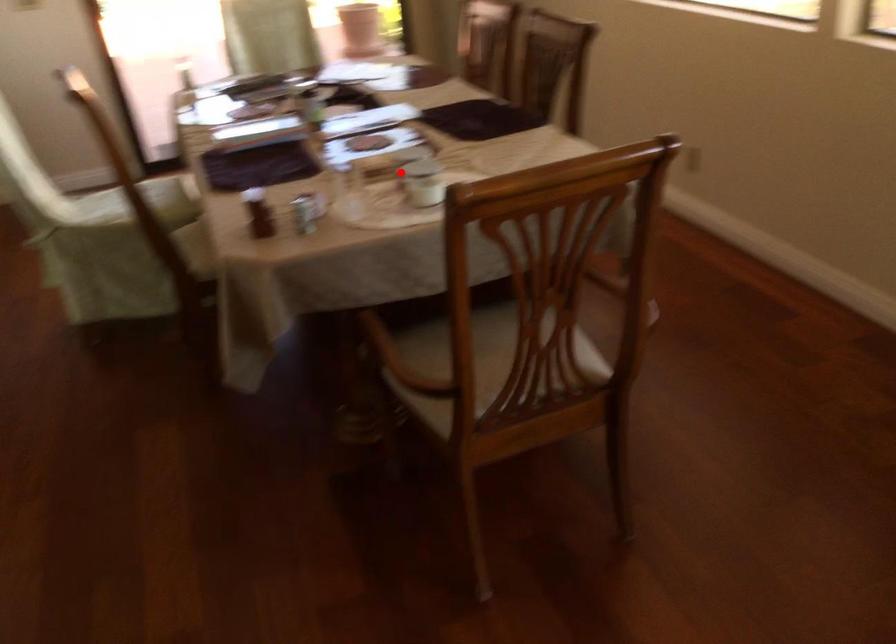
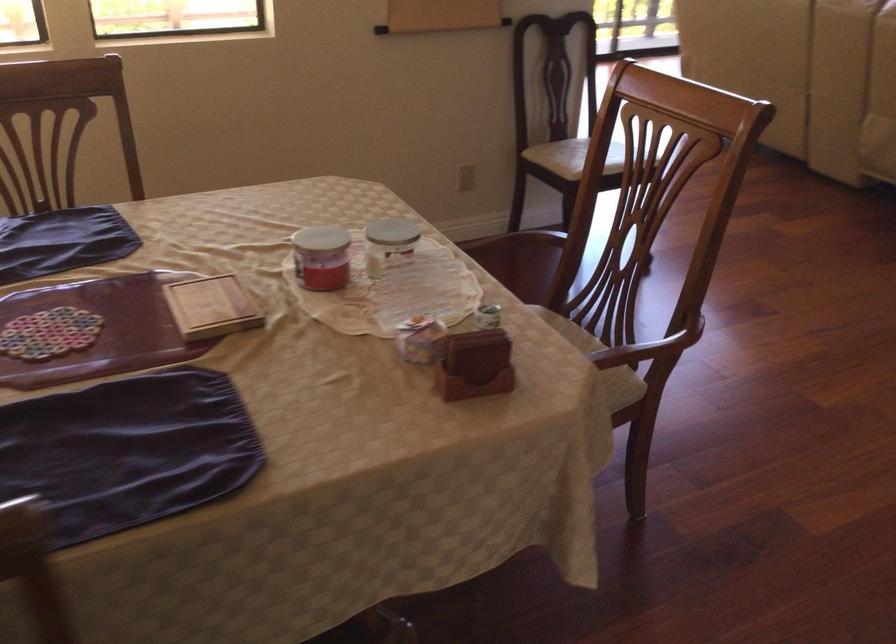
Question: A red point is marked in image1. In image2, is the corresponding 3D point closer to the camera or farther? Reply with the corresponding letter.

Choices:
 (A) The corresponding 3D point is closer.
 (B) The corresponding 3D point is farther.

Answer: (A)